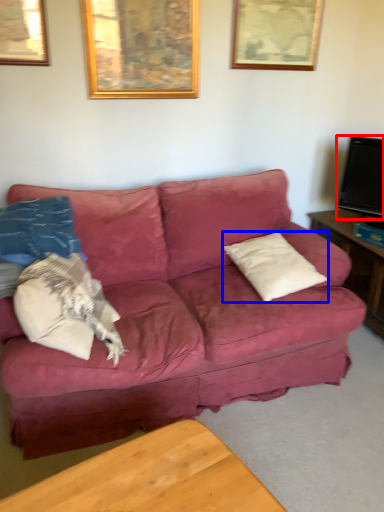
Question: Among these objects, which one is nearest to the camera, television (highlighted by a red box) or pillow (highlighted by a blue box)?

Choices:
 (A) television
 (B) pillow

Answer: (B)